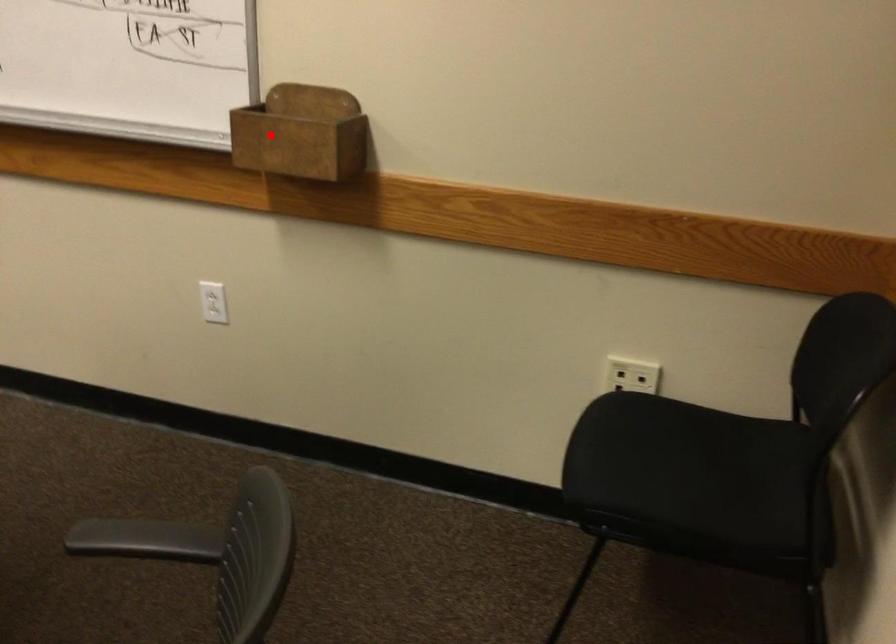
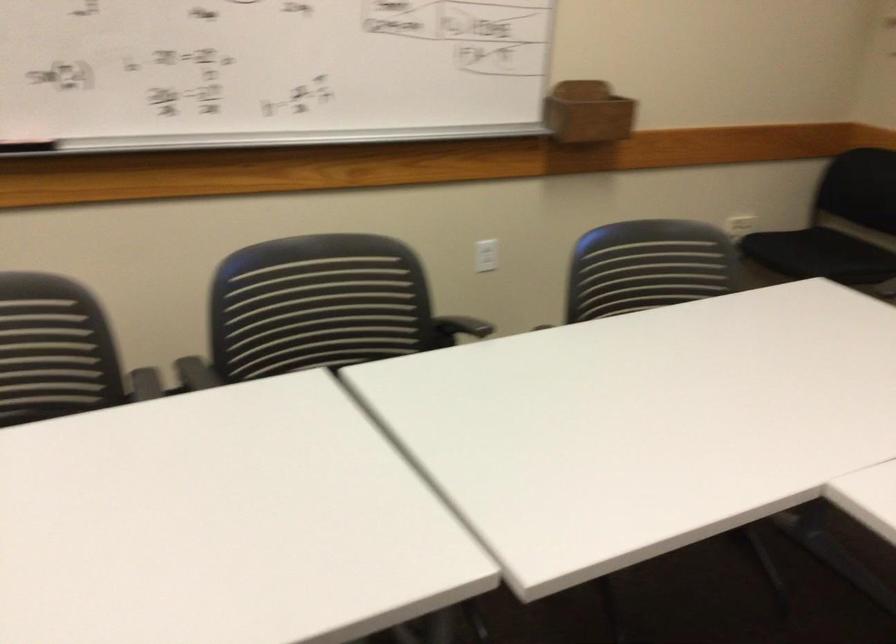
Where in the second image is the point corresponding to the highlighted location from the first image?

(588, 111)